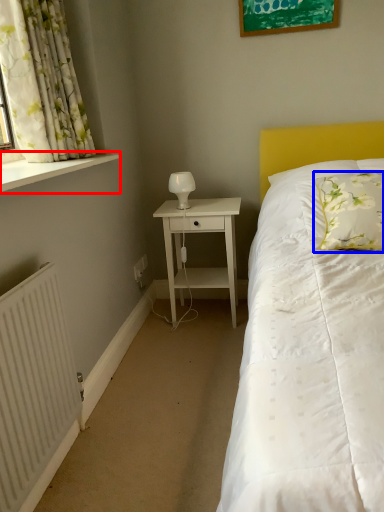
Question: Which object appears farthest to the camera in this image, window sill (highlighted by a red box) or pillow (highlighted by a blue box)?

Choices:
 (A) window sill
 (B) pillow

Answer: (B)